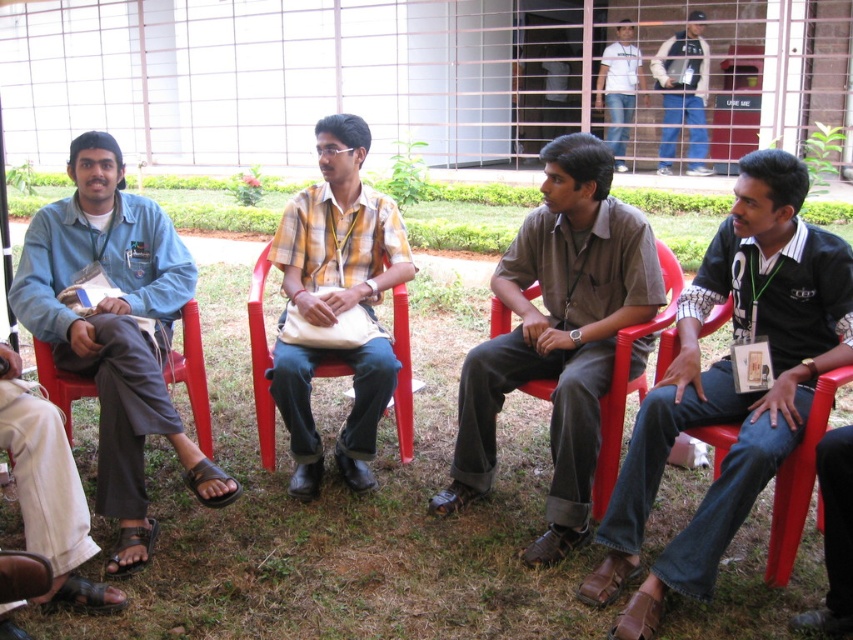
Question: Where is denim shirt at left located in relation to red plastic chair at left in the image?

Choices:
 (A) above
 (B) below

Answer: (A)

Question: Which is nearer to the red plastic chair at right?

Choices:
 (A) jeans at right
 (B) matte plastic chair at center
 (C) red plastic chair at center
 (D) denim jacket at upper right

Answer: (A)

Question: Can you confirm if jeans at right is positioned above denim jacket at upper right?

Choices:
 (A) no
 (B) yes

Answer: (A)

Question: Which of the following is the farthest from the observer?

Choices:
 (A) red plastic chair at right
 (B) denim shirt at left
 (C) white t-shirt at upper center
 (D) red plastic chair at center

Answer: (C)

Question: Which of the following is the closest to the observer?

Choices:
 (A) red plastic chair at center
 (B) matte plastic chair at center

Answer: (A)

Question: Considering the relative positions of red plastic chair at right and red plastic chair at left in the image provided, where is red plastic chair at right located with respect to red plastic chair at left?

Choices:
 (A) below
 (B) above

Answer: (A)